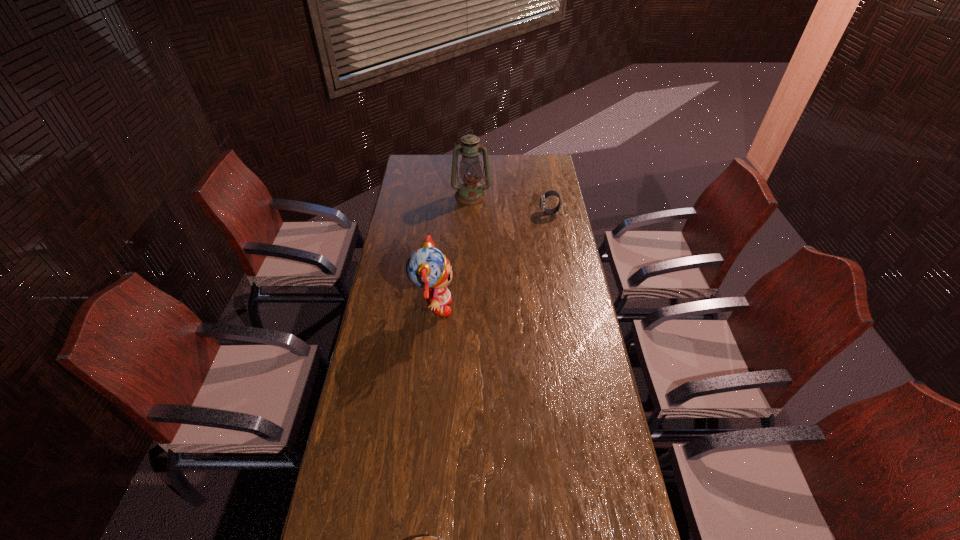
In order to click on vacant space that's between the third nearest object and the oil lamp in this screenshot , I will do `click(511, 204)`.

Select which object appears as the third closest to the tallest object. Please provide its 2D coordinates. Your answer should be formatted as a tuple, i.e. [(x, y)], where the tuple contains the x and y coordinates of a point satisfying the conditions above.

[(426, 539)]

Locate an element on the screen. This screenshot has width=960, height=540. the third closest object to the farthest object is located at coordinates point(426,539).

This screenshot has width=960, height=540. Identify the location of vacant area in the image that satisfies the following two spatial constraints: 1. on the front side of the farthest object; 2. on the face of the doll. (468, 308).